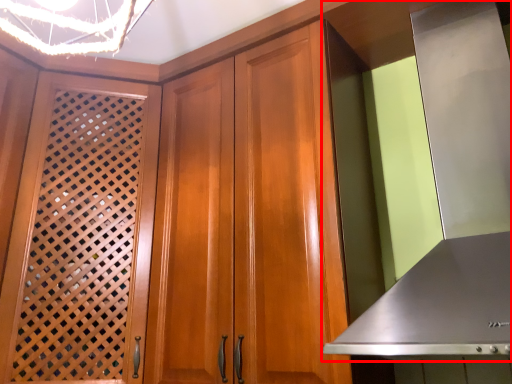
Question: Where is exhaust hood (annotated by the red box) located in relation to screen door in the image?

Choices:
 (A) left
 (B) right

Answer: (B)